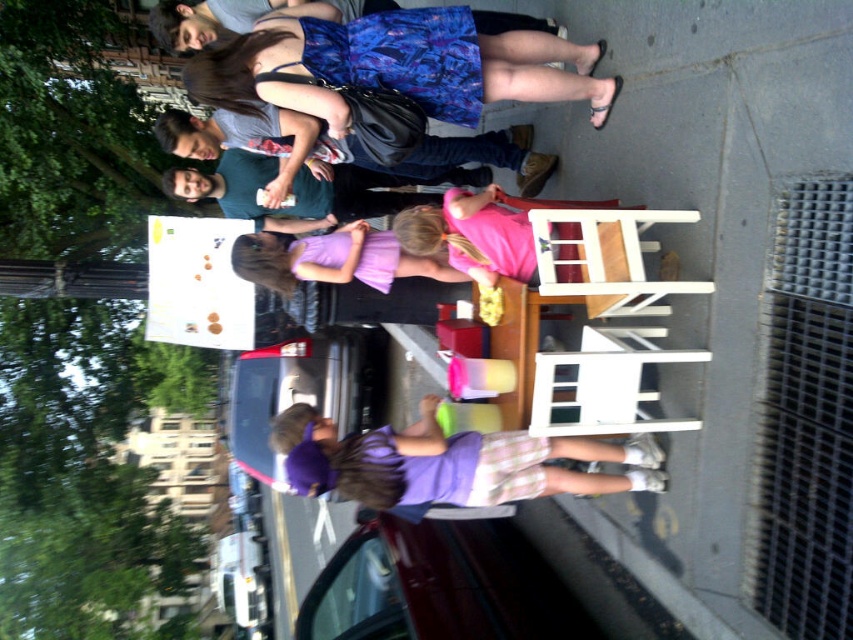
Is point (410, 241) in front of point (374, 269)?

Yes.

Can you confirm if pink matte chair at center is taller than purple fabric dress at center?

Yes.

You are a GUI agent. You are given a task and a screenshot of the screen. Output one action in this format:
    pyautogui.click(x=<x>, y=<y>)
    Task: Click on the pink matte chair at center
    Image resolution: width=853 pixels, height=640 pixels.
    Given the screenshot: What is the action you would take?
    pyautogui.click(x=474, y=234)

Does purple cotton dress at center appear on the right side of pink matte chair at center?

In fact, purple cotton dress at center is to the left of pink matte chair at center.

Is purple cotton dress at center closer to camera compared to pink matte chair at center?

Yes, it is.

I want to click on purple cotton dress at center, so click(x=445, y=461).

At what (x,y) coordinates should I click in order to perform the action: click on purple cotton dress at center. Please return your answer as a coordinate pair (x, y). Image resolution: width=853 pixels, height=640 pixels. Looking at the image, I should click on (445, 461).

This screenshot has height=640, width=853. What do you see at coordinates (397, 67) in the screenshot?
I see `printed fabric dress at upper center` at bounding box center [397, 67].

Who is taller, printed fabric dress at upper center or purple cotton dress at center?

With more height is printed fabric dress at upper center.

Is point (276, 36) closer to camera compared to point (502, 445)?

That is False.

The width and height of the screenshot is (853, 640). Find the location of `printed fabric dress at upper center`. printed fabric dress at upper center is located at coordinates (397, 67).